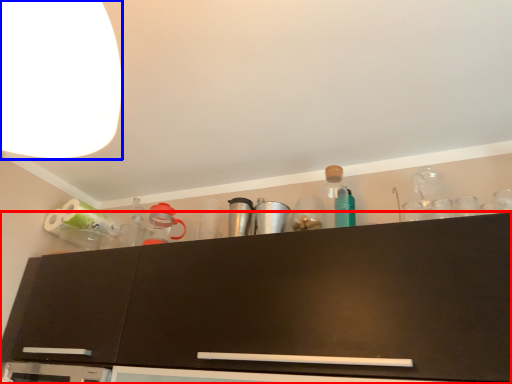
Question: Which of the following is the farthest to the observer, cabinetry (highlighted by a red box) or lamp (highlighted by a blue box)?

Choices:
 (A) cabinetry
 (B) lamp

Answer: (A)